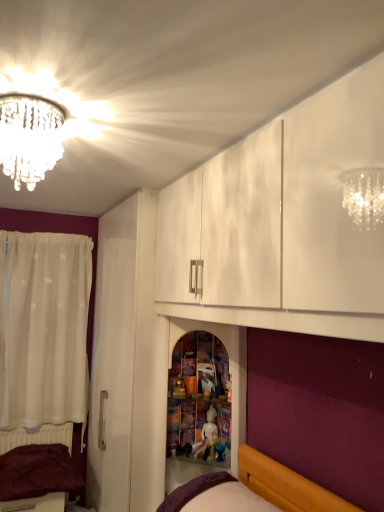
Image resolution: width=384 pixels, height=512 pixels. I want to click on free space above white sheer curtain at left (from a real-world perspective), so click(x=44, y=231).